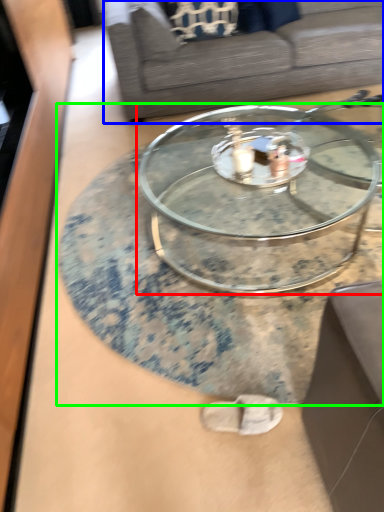
Question: Which object is the closest to the coffee table (highlighted by a red box)? Choose among these: studio couch (highlighted by a blue box) or coffee table (highlighted by a green box).

Choices:
 (A) studio couch
 (B) coffee table

Answer: (B)